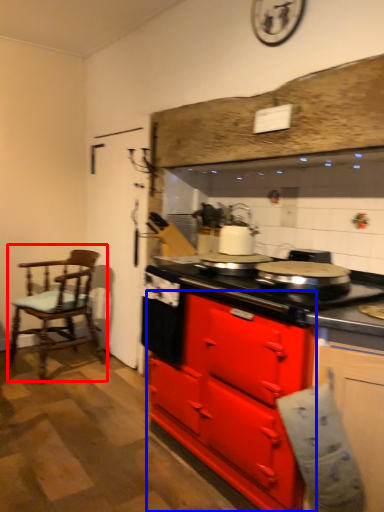
Question: Which object is further to the camera taking this photo, chair (highlighted by a red box) or cabinetry (highlighted by a blue box)?

Choices:
 (A) chair
 (B) cabinetry

Answer: (A)